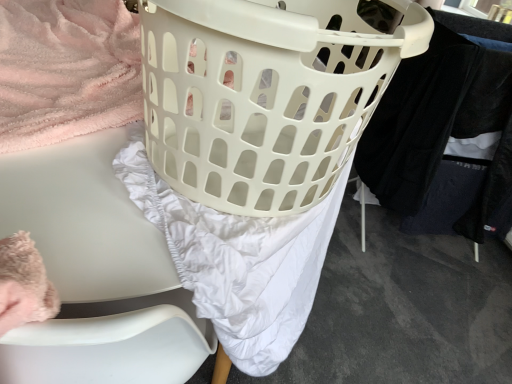
Question: Could you tell me if white plastic laundry basket at center is facing black cotton pants at right?

Choices:
 (A) no
 (B) yes

Answer: (A)

Question: Is white plastic laundry basket at center behind black cotton pants at right?

Choices:
 (A) yes
 (B) no

Answer: (B)

Question: Is white plastic laundry basket at center outside of black cotton pants at right?

Choices:
 (A) yes
 (B) no

Answer: (A)

Question: Is the surface of white plastic laundry basket at center in direct contact with black cotton pants at right?

Choices:
 (A) yes
 (B) no

Answer: (B)

Question: Considering the relative positions of white plastic laundry basket at center and black cotton pants at right in the image provided, is white plastic laundry basket at center in front of black cotton pants at right?

Choices:
 (A) yes
 (B) no

Answer: (A)

Question: From the image's perspective, is white plastic chair at left located above or below black cotton pants at right?

Choices:
 (A) below
 (B) above

Answer: (A)

Question: Considering the positions of point (97, 157) and point (465, 135), is point (97, 157) closer or farther from the camera than point (465, 135)?

Choices:
 (A) farther
 (B) closer

Answer: (B)

Question: Is white plastic chair at left situated inside black cotton pants at right or outside?

Choices:
 (A) inside
 (B) outside

Answer: (B)

Question: In terms of size, does white plastic chair at left appear bigger or smaller than black cotton pants at right?

Choices:
 (A) small
 (B) big

Answer: (A)

Question: Looking at the image, does black cotton pants at right seem bigger or smaller compared to white plastic chair at left?

Choices:
 (A) big
 (B) small

Answer: (A)

Question: Is black cotton pants at right in front of or behind white plastic chair at left in the image?

Choices:
 (A) front
 (B) behind

Answer: (B)

Question: From a real-world perspective, is black cotton pants at right positioned above or below white plastic chair at left?

Choices:
 (A) below
 (B) above

Answer: (B)

Question: Looking at their shapes, would you say black cotton pants at right is wider or thinner than white plastic chair at left?

Choices:
 (A) wide
 (B) thin

Answer: (A)

Question: Would you say white plastic chair at left is inside or outside white plastic laundry basket at center?

Choices:
 (A) inside
 (B) outside

Answer: (B)

Question: Considering the positions of white plastic chair at left and white plastic laundry basket at center in the image, is white plastic chair at left bigger or smaller than white plastic laundry basket at center?

Choices:
 (A) small
 (B) big

Answer: (B)